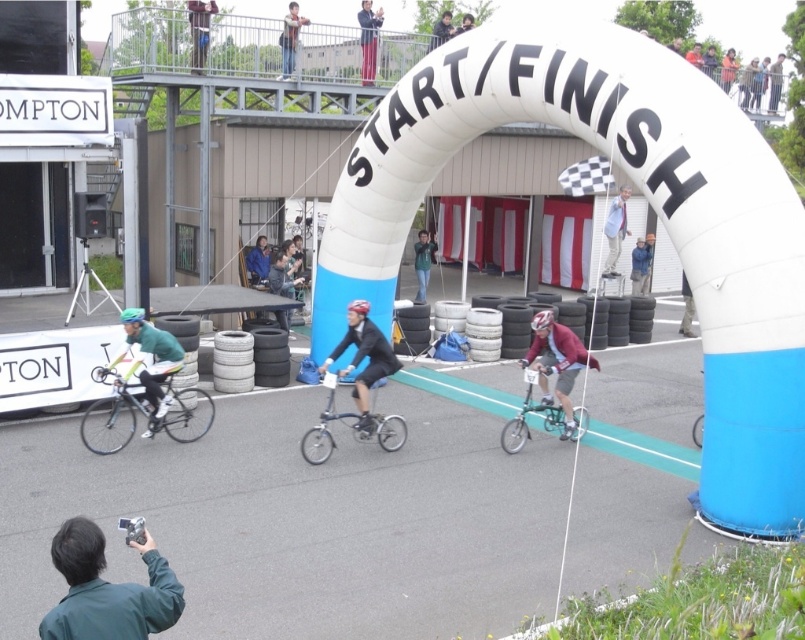
Question: Which object appears closest to the camera in this image?

Choices:
 (A) dark blue jacket at upper center
 (B) red matte bicycle helmet at center
 (C) blue fabric pants at upper center
 (D) black rubber tire at center

Answer: (B)

Question: Estimate the real-world distances between objects in this image. Which object is closer to the green matte bicycle helmet at center?

Choices:
 (A) dark blue jacket at upper center
 (B) dark blue helmet at center

Answer: (A)

Question: Does red pants at upper center appear under red matte bicycle helmet at center?

Choices:
 (A) no
 (B) yes

Answer: (A)

Question: Can you confirm if green matte jacket at lower left is positioned to the left of red pants at upper center?

Choices:
 (A) yes
 (B) no

Answer: (A)

Question: Is dark blue jacket at upper center in front of red matte bicycle helmet at center?

Choices:
 (A) yes
 (B) no

Answer: (B)

Question: Which point is closer to the camera?

Choices:
 (A) green matte jacket at center
 (B) light blue denim jacket at upper center
 (C) red pants at upper center

Answer: (B)